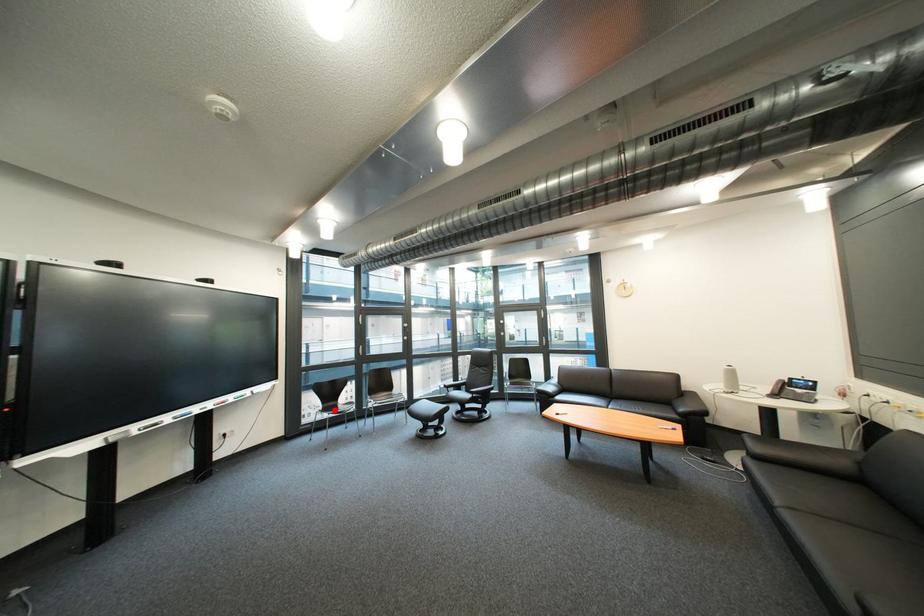
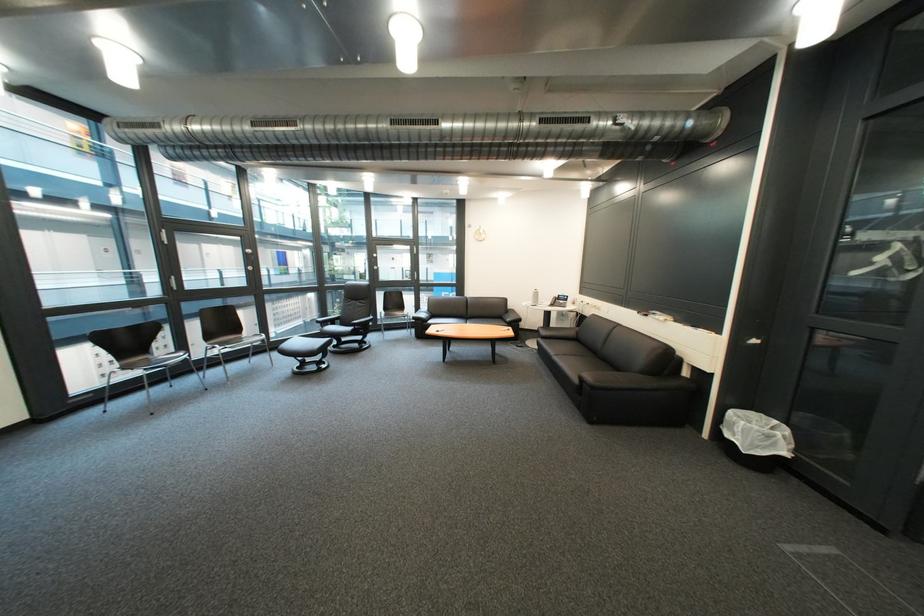
Question: I am providing you with two images of the same scene from different viewpoints. In image1, a red point is highlighted. Considering the same 3D point in image2, which of the following is correct?

Choices:
 (A) It is closer
 (B) It is farther

Answer: (A)